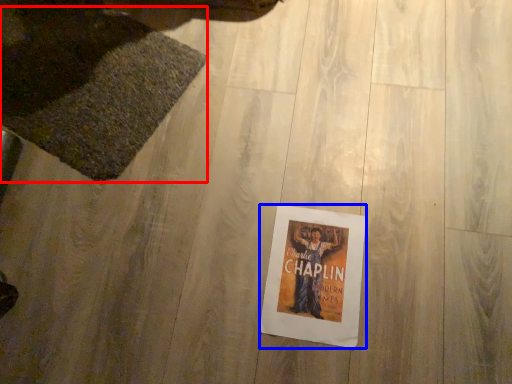
Question: Which of the following is the farthest to the observer, mat (highlighted by a red box) or poster (highlighted by a blue box)?

Choices:
 (A) mat
 (B) poster

Answer: (A)